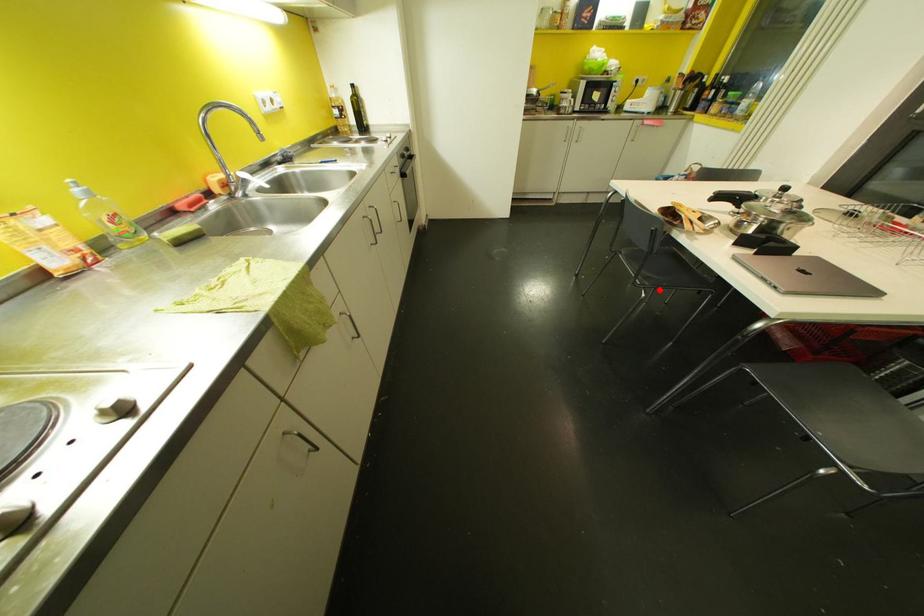
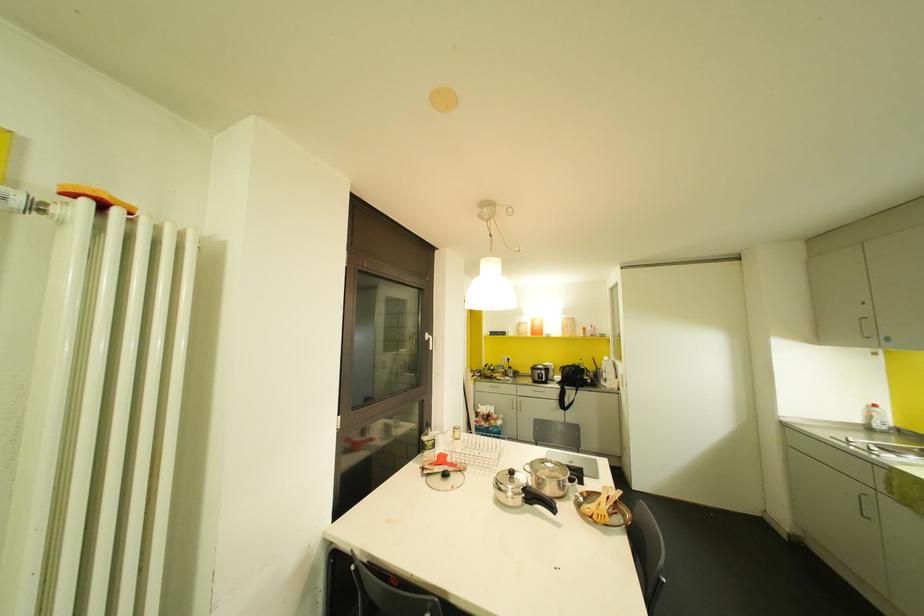
Question: I am providing you with two images of the same scene from different viewpoints. A red point is marked on the first image. Is the red point's position out of view in image 2?

Choices:
 (A) Yes
 (B) No

Answer: (A)